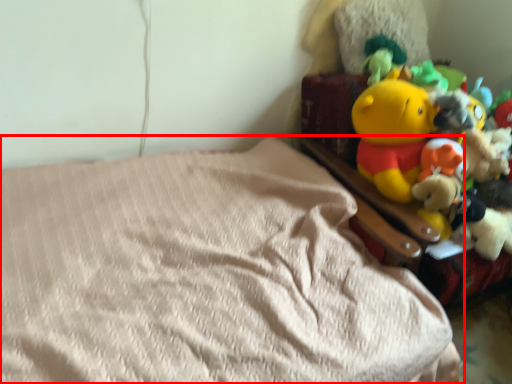
Question: From the image, what is the correct spatial relationship of bed (annotated by the red box) in relation to toy?

Choices:
 (A) right
 (B) left

Answer: (B)